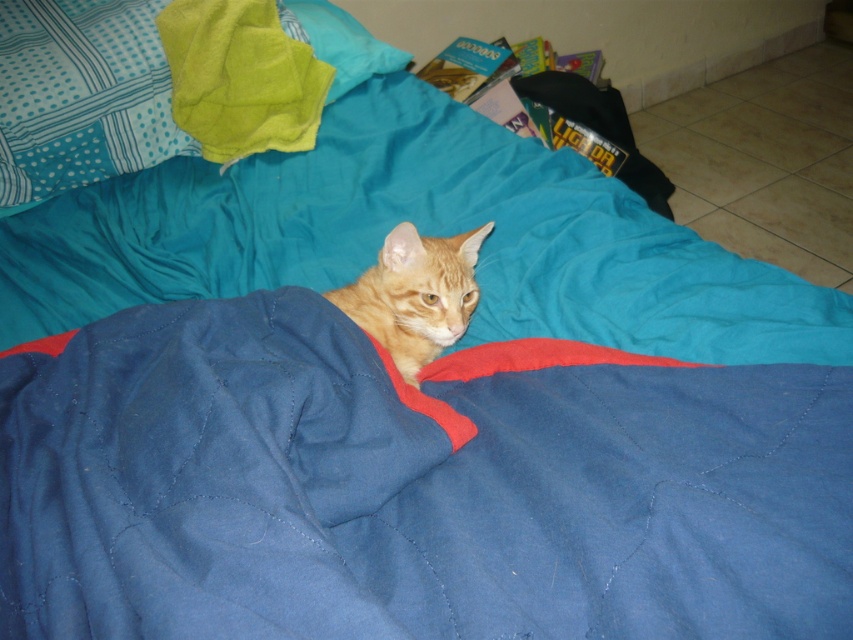
You are trying to reach the orange fur cat at center from the edge of the bed. According to the scene, is the blue quilted bedsheet at center blocking your path?

The blue quilted bedsheet at center is in front of the orange fur cat at center, so it is blocking the path to the cat.

You are a pet sitter who needs to check the cat. You see the blue quilted bedsheet at center and the orange fur cat at center. Which object is closer to you?

The orange fur cat at center is closer to you because the blue quilted bedsheet at center is located above it, meaning the cat is beneath the bedsheet and thus nearer to your viewpoint.

You are trying to determine which item on the bed is taller between the blue quilted bedsheet at center and the orange fur cat at center. Based on the scene, which one is taller?

The blue quilted bedsheet at center is taller than the orange fur cat at center according to the description.